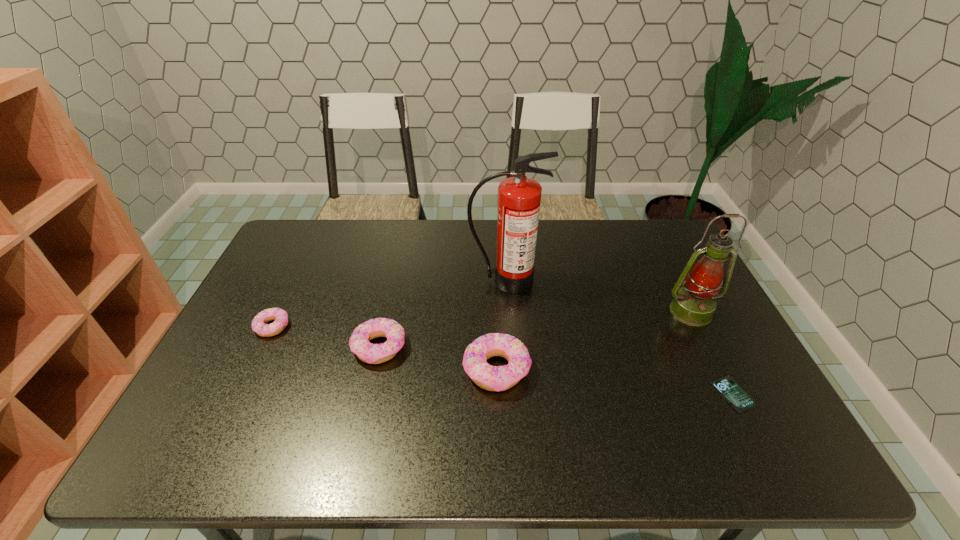
Identify the location of object that is at the near right corner. This screenshot has width=960, height=540. (726, 385).

I want to click on free space at the far edge, so click(551, 228).

The height and width of the screenshot is (540, 960). What are the coordinates of `vacant space at the near edge of the desktop` in the screenshot? It's located at (485, 407).

What are the coordinates of `vacant space at the left edge of the desktop` in the screenshot? It's located at (255, 285).

In the image, there is a desktop. What are the coordinates of `vacant space at the right edge` in the screenshot? It's located at (715, 328).

Where is `vacant region at the far right corner of the desktop`? The height and width of the screenshot is (540, 960). vacant region at the far right corner of the desktop is located at coordinates (674, 231).

At what (x,y) coordinates should I click in order to perform the action: click on vacant space at the near right corner of the desktop. Please return your answer as a coordinate pair (x, y). The height and width of the screenshot is (540, 960). Looking at the image, I should click on (702, 399).

This screenshot has width=960, height=540. Identify the location of free spot between the second object from left to right and the shortest object. (556, 370).

Identify the location of vacant point located between the rightmost doughnut and the second shortest doughnut. (438, 358).

Identify the location of free space between the second tallest object and the rightmost doughnut. The image size is (960, 540). (593, 340).